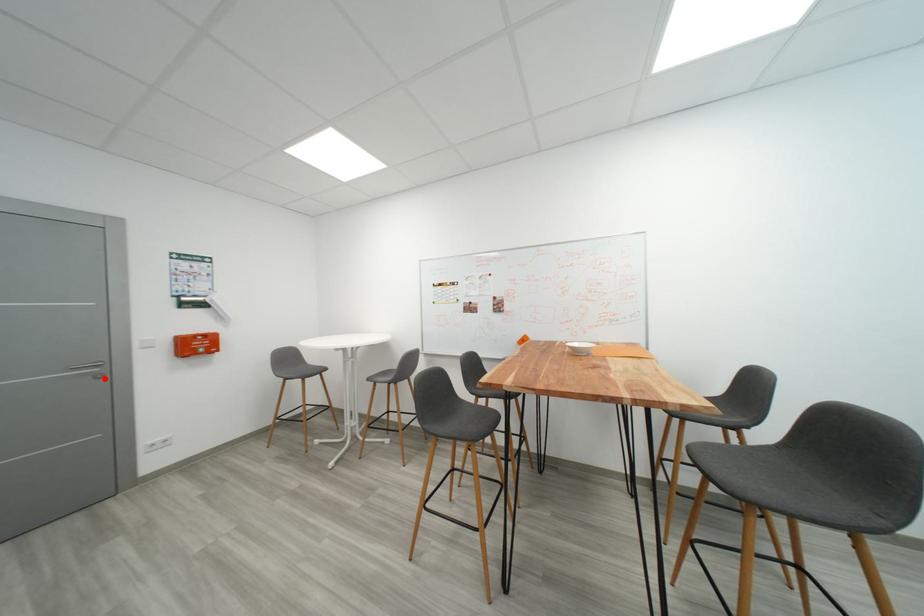
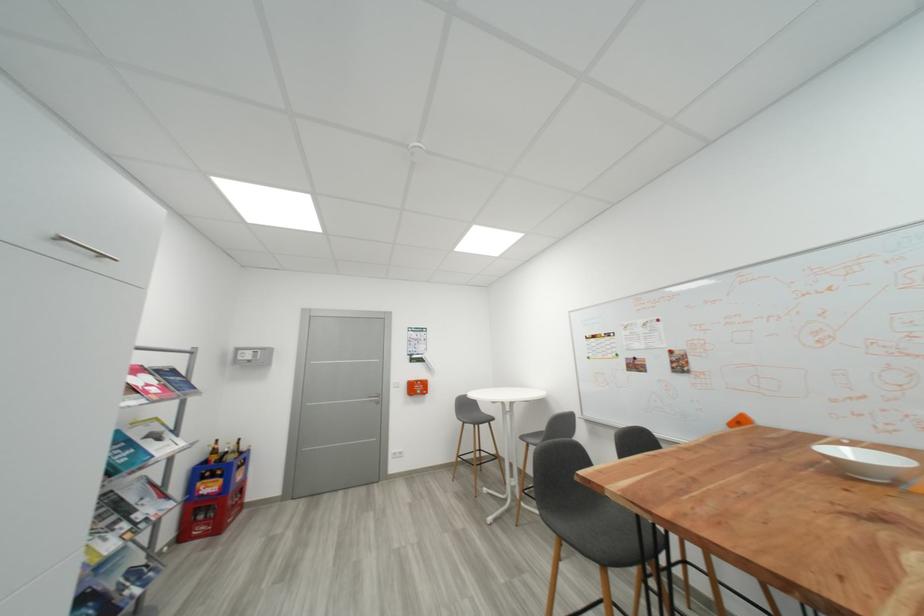
Locate, in the second image, the point that corresponds to the highlighted location in the first image.

(383, 405)